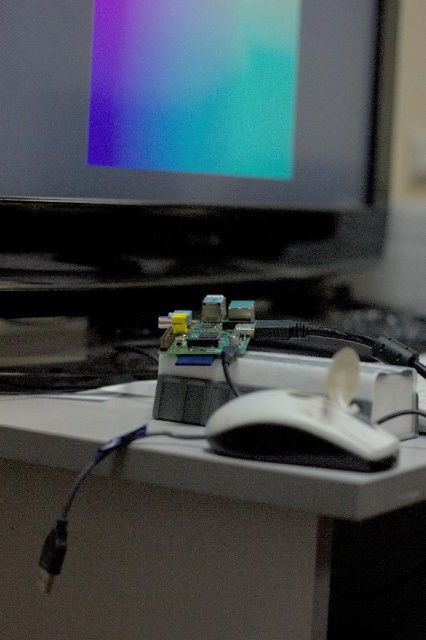
Question: Which point appears closest to the camera in this image?

Choices:
 (A) (40, 417)
 (B) (233, 4)

Answer: (A)

Question: Can you confirm if matte black monitor at upper center is positioned to the right of white matte mouse at center?

Choices:
 (A) no
 (B) yes

Answer: (A)

Question: Can you confirm if white matte table at center is thinner than white matte mouse at center?

Choices:
 (A) no
 (B) yes

Answer: (A)

Question: Which point is farther to the camera?

Choices:
 (A) (351, 353)
 (B) (215, 49)
 (C) (150, 548)

Answer: (B)

Question: Is white matte table at center behind white matte mouse at center?

Choices:
 (A) no
 (B) yes

Answer: (A)

Question: Among these points, which one is farthest from the camera?

Choices:
 (A) (362, 420)
 (B) (16, 592)

Answer: (B)